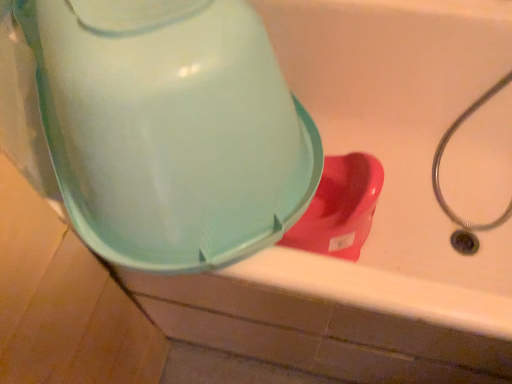
Question: From a real-world perspective, is matte plastic water cooler at upper left above or below rubberized plastic toilet at lower right?

Choices:
 (A) below
 (B) above

Answer: (B)

Question: Considering the positions of matte plastic water cooler at upper left and rubberized plastic toilet at lower right in the image, is matte plastic water cooler at upper left bigger or smaller than rubberized plastic toilet at lower right?

Choices:
 (A) big
 (B) small

Answer: (A)

Question: Which is correct: matte plastic water cooler at upper left is inside rubberized plastic toilet at lower right, or outside of it?

Choices:
 (A) outside
 (B) inside

Answer: (A)

Question: Looking at their shapes, would you say rubberized plastic toilet at lower right is wider or thinner than matte plastic water cooler at upper left?

Choices:
 (A) wide
 (B) thin

Answer: (B)

Question: Is point (289, 230) positioned closer to the camera than point (136, 11)?

Choices:
 (A) farther
 (B) closer

Answer: (A)

Question: Considering the relative positions of rubberized plastic toilet at lower right and matte plastic water cooler at upper left in the image provided, is rubberized plastic toilet at lower right to the left or to the right of matte plastic water cooler at upper left?

Choices:
 (A) left
 (B) right

Answer: (B)

Question: In the image, is rubberized plastic toilet at lower right positioned in front of or behind matte plastic water cooler at upper left?

Choices:
 (A) behind
 (B) front

Answer: (A)